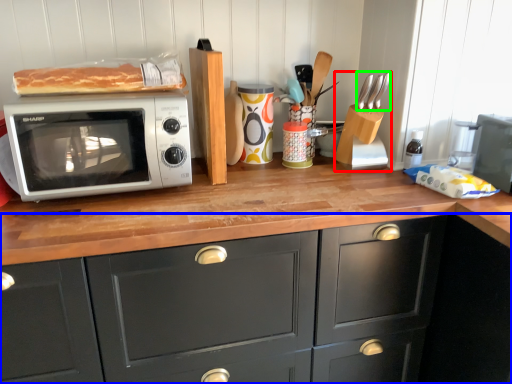
Question: Estimate the real-world distances between objects in this image. Which object is closer to appliance (highlighted by a red box), cabinetry (highlighted by a blue box) or silverware (highlighted by a green box)?

Choices:
 (A) cabinetry
 (B) silverware

Answer: (B)